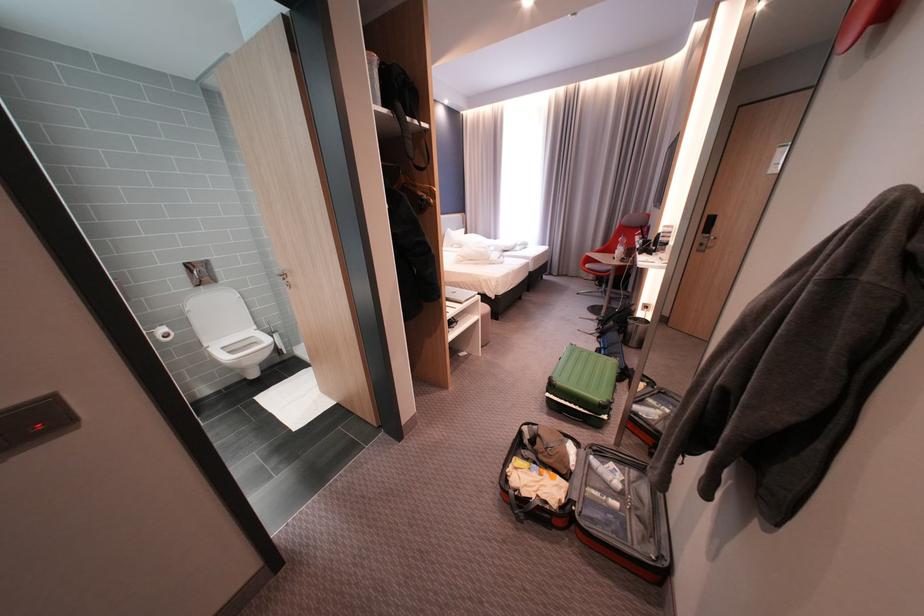
Find where to clos the white toilet lid. Please return your answer as a coordinate pair (x, y).

(216, 313)